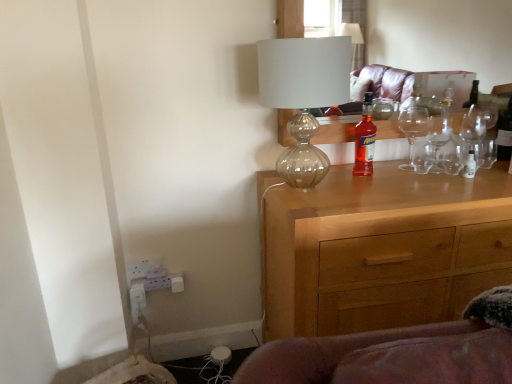
Question: Does clear glass bottle at upper right, placed as the 2th bottle when sorted from left to right, turn towards transparent glass lampshade at upper center?

Choices:
 (A) no
 (B) yes

Answer: (A)

Question: Does clear glass bottle at upper right, placed as the 2th bottle when sorted from left to right, lie in front of transparent glass lampshade at upper center?

Choices:
 (A) yes
 (B) no

Answer: (B)

Question: From the image's perspective, is clear glass bottle at upper right, placed as the 2th bottle when sorted from left to right, located above transparent glass lampshade at upper center?

Choices:
 (A) no
 (B) yes

Answer: (B)

Question: Can transparent glass lampshade at upper center be found inside clear glass bottle at upper right, placed as the first bottle when sorted from back to front?

Choices:
 (A) no
 (B) yes

Answer: (A)

Question: Does clear glass bottle at upper right, the first bottle viewed from the right, appear on the right side of transparent glass lampshade at upper center?

Choices:
 (A) yes
 (B) no

Answer: (A)

Question: Can you confirm if clear glass bottle at upper right, which is the second bottle from front to back, is taller than transparent glass lampshade at upper center?

Choices:
 (A) yes
 (B) no

Answer: (B)

Question: Does transparent glass lampshade at upper center lie behind translucent glass bottle at center, marked as the 1th bottle in a left-to-right arrangement?

Choices:
 (A) no
 (B) yes

Answer: (A)

Question: Does transparent glass lampshade at upper center appear on the left side of translucent glass bottle at center, which is the first bottle from front to back?

Choices:
 (A) yes
 (B) no

Answer: (A)

Question: Is translucent glass bottle at center, which is the first bottle from front to back, a part of transparent glass lampshade at upper center?

Choices:
 (A) yes
 (B) no

Answer: (B)

Question: Considering the relative positions of transparent glass lampshade at upper center and translucent glass bottle at center, placed as the 2th bottle when sorted from right to left, in the image provided, is transparent glass lampshade at upper center to the right of translucent glass bottle at center, placed as the 2th bottle when sorted from right to left, from the viewer's perspective?

Choices:
 (A) yes
 (B) no

Answer: (B)

Question: Is transparent glass lampshade at upper center positioned in front of translucent glass bottle at center, which is the first bottle from front to back?

Choices:
 (A) no
 (B) yes

Answer: (B)

Question: Are transparent glass lampshade at upper center and translucent glass bottle at center, the 2th bottle positioned from the back, beside each other?

Choices:
 (A) yes
 (B) no

Answer: (B)

Question: Is translucent glass bottle at center, the 2th bottle positioned from the back, not within transparent glass lampshade at upper center?

Choices:
 (A) no
 (B) yes

Answer: (B)